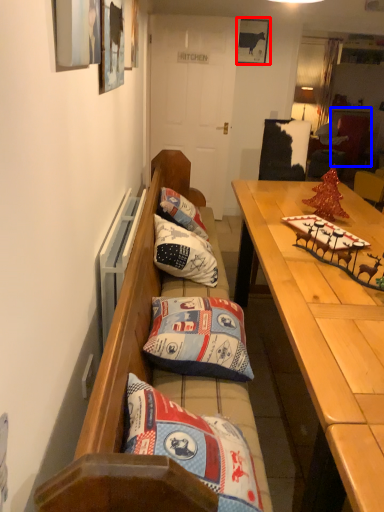
Question: Which point is further to the camera, picture frame (highlighted by a red box) or cabinetry (highlighted by a blue box)?

Choices:
 (A) picture frame
 (B) cabinetry

Answer: (B)